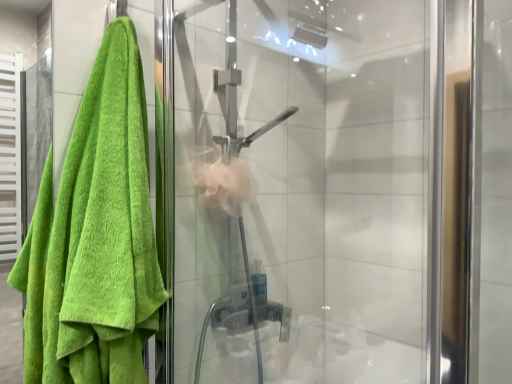
Question: In the image, is green terry cloth towel at left on the left side or the right side of transparent glass shower door at center?

Choices:
 (A) left
 (B) right

Answer: (A)

Question: Based on their sizes in the image, would you say green terry cloth towel at left is bigger or smaller than transparent glass shower door at center?

Choices:
 (A) big
 (B) small

Answer: (B)

Question: Is green terry cloth towel at left situated inside transparent glass shower door at center or outside?

Choices:
 (A) outside
 (B) inside

Answer: (A)

Question: Would you say transparent glass shower door at center is to the left or to the right of green terry cloth towel at left in the picture?

Choices:
 (A) right
 (B) left

Answer: (A)

Question: From a real-world perspective, is transparent glass shower door at center above or below green terry cloth towel at left?

Choices:
 (A) above
 (B) below

Answer: (A)

Question: Looking at the image, does transparent glass shower door at center seem bigger or smaller compared to green terry cloth towel at left?

Choices:
 (A) small
 (B) big

Answer: (B)

Question: From their relative heights in the image, would you say transparent glass shower door at center is taller or shorter than green terry cloth towel at left?

Choices:
 (A) short
 (B) tall

Answer: (B)